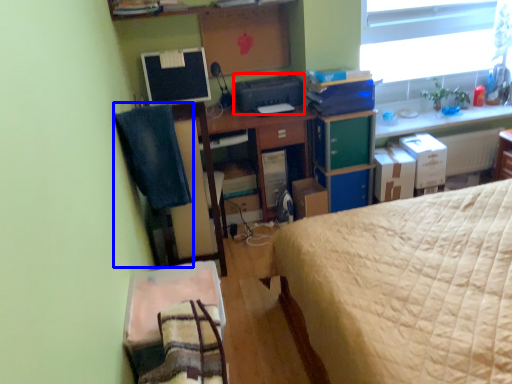
Question: Among these objects, which one is nearest to the camera, printer (highlighted by a red box) or computer chair (highlighted by a blue box)?

Choices:
 (A) printer
 (B) computer chair

Answer: (B)